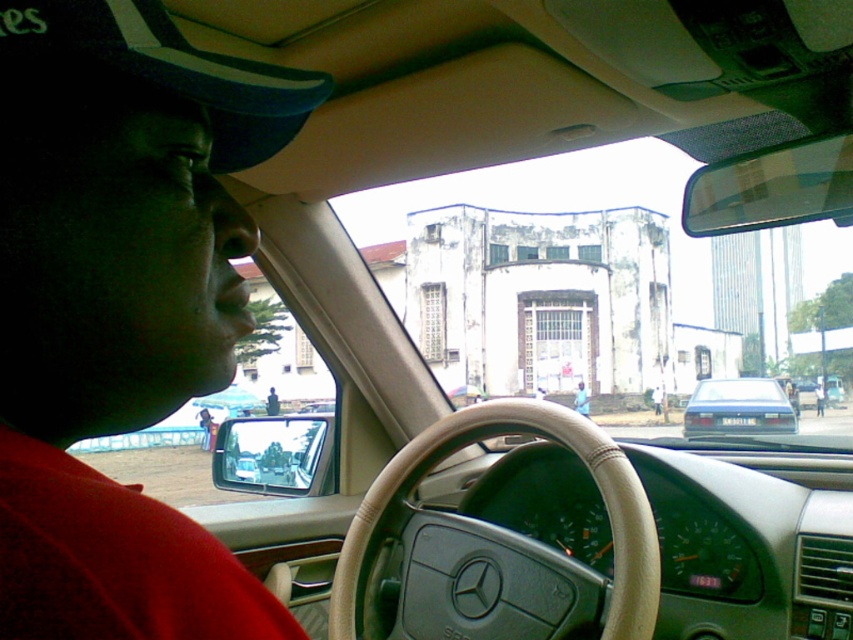
You are sitting in the driver seat of the car shown in the image. You see two points marked on the windshield. The first point is at coordinates point [143,292] and the second point is at point [751,426]. Which point is closer to you?

Point [143,292] is closer to the viewer than point [751,426].